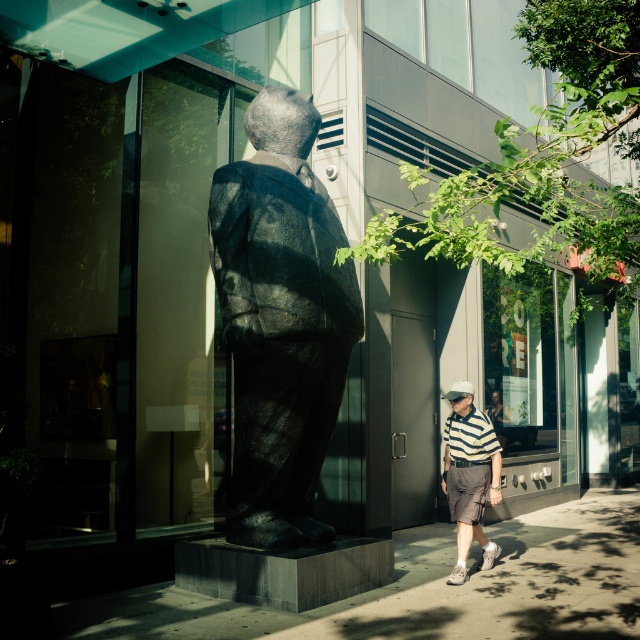
Is concrete sidewalk at center positioned at the back of striped cotton polo shirt at center?

No, it is in front of striped cotton polo shirt at center.

Can you confirm if concrete sidewalk at center is shorter than striped cotton polo shirt at center?

Correct, concrete sidewalk at center is not as tall as striped cotton polo shirt at center.

Is point (504, 592) farther from viewer compared to point (477, 449)?

No.

At what (x,y) coordinates should I click in order to perform the action: click on concrete sidewalk at center. Please return your answer as a coordinate pair (x, y). Looking at the image, I should click on (428, 588).

Who is positioned more to the left, black textured statue at center or white matte baseball hat at center?

Positioned to the left is black textured statue at center.

Can you confirm if black textured statue at center is taller than white matte baseball hat at center?

Yes.

What are the coordinates of `black textured statue at center` in the screenshot? It's located at (280, 321).

Between black textured statue at center and striped cotton polo shirt at center, which one is positioned lower?

Positioned lower is striped cotton polo shirt at center.

Consider the image. Does black textured statue at center appear on the right side of striped cotton polo shirt at center?

Incorrect, black textured statue at center is not on the right side of striped cotton polo shirt at center.

Does point (314, 220) come behind point (497, 499)?

No, (314, 220) is closer to viewer.

Identify the location of black textured statue at center. (280, 321).